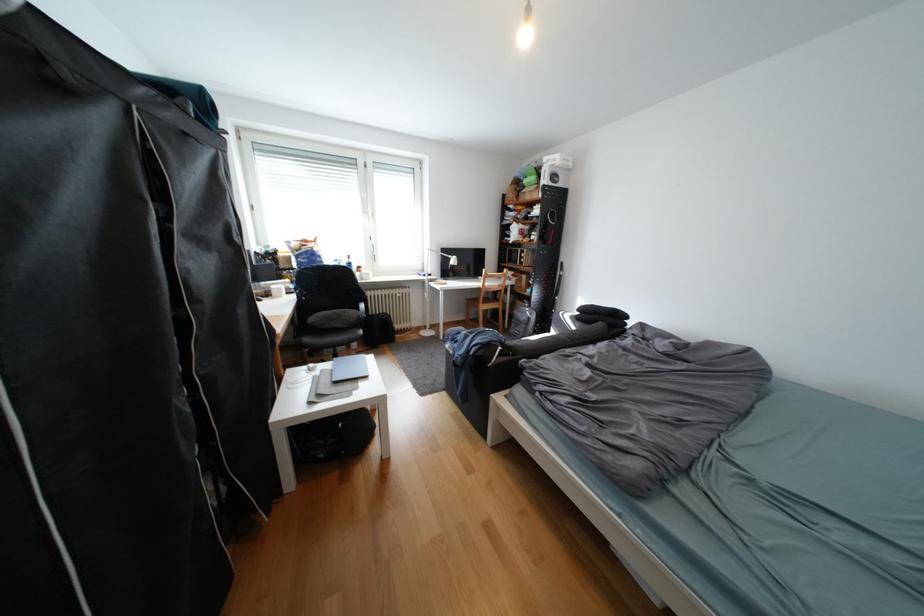
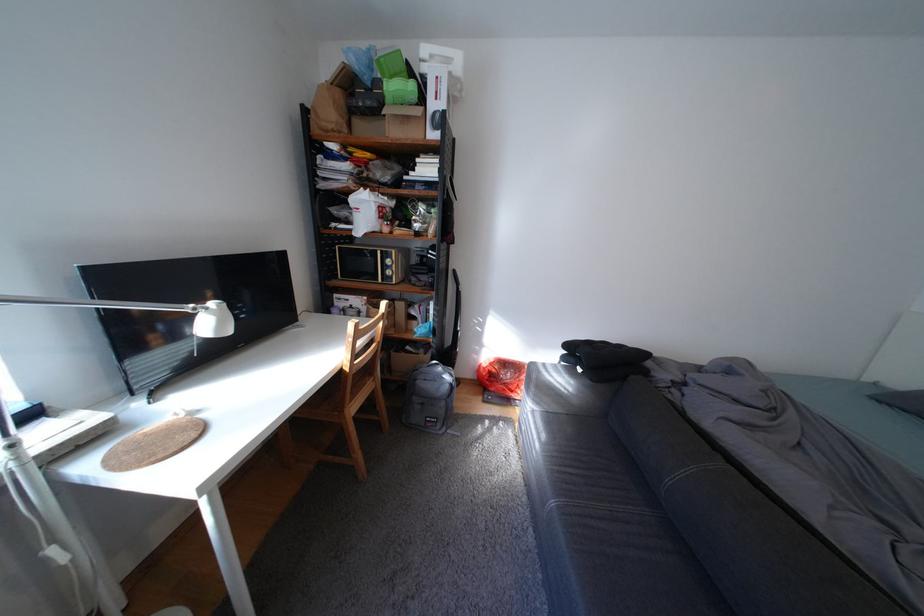
Locate, in the second image, the point that corresponds to [674,351] in the first image.

(773, 407)